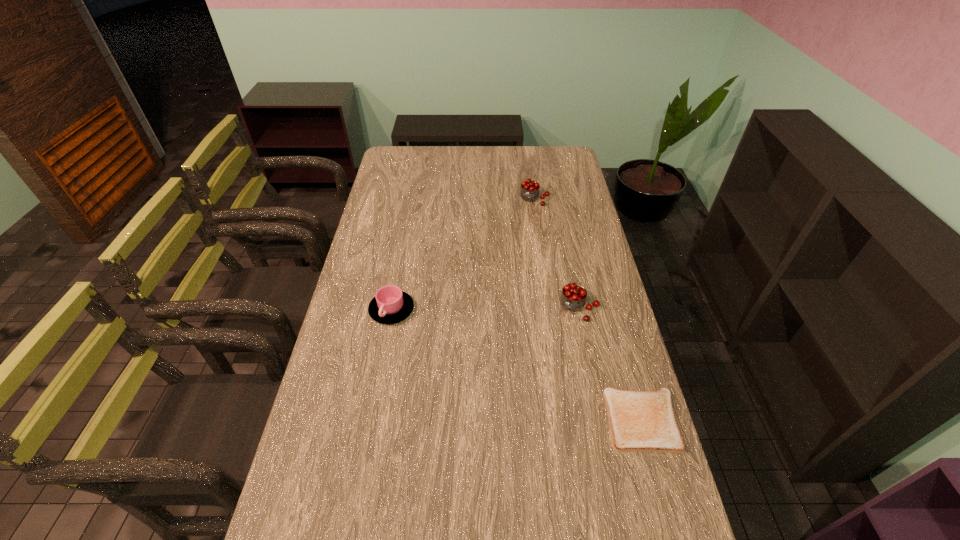
You are a GUI agent. You are given a task and a screenshot of the screen. Output one action in this format:
    pyautogui.click(x=<x>, y=<y>)
    Task: Click on the free spot on the desktop that is between the leftmost object and the shortest object and is positioned on the handle side of the nearer pot filled with cherries
    The height and width of the screenshot is (540, 960).
    Given the screenshot: What is the action you would take?
    pyautogui.click(x=540, y=375)

Identify the location of free space on the desktop that is between the third tallest object and the shortest object and is positioned on the handle side of the farthest object. (484, 350).